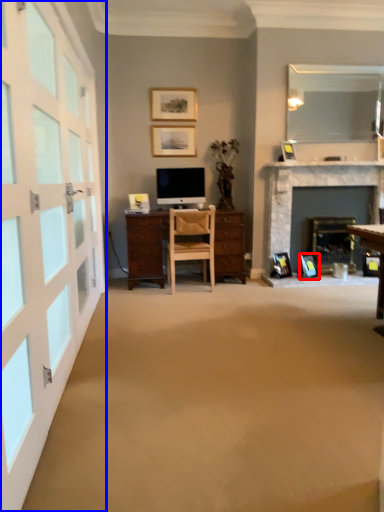
Question: Among these objects, which one is nearest to the camera, picture frame (highlighted by a red box) or garage door (highlighted by a blue box)?

Choices:
 (A) picture frame
 (B) garage door

Answer: (B)